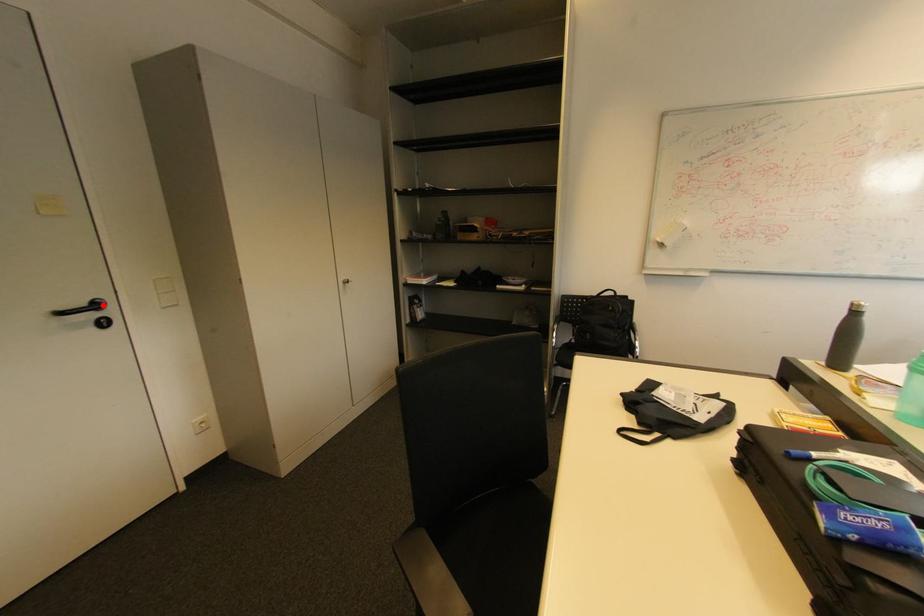
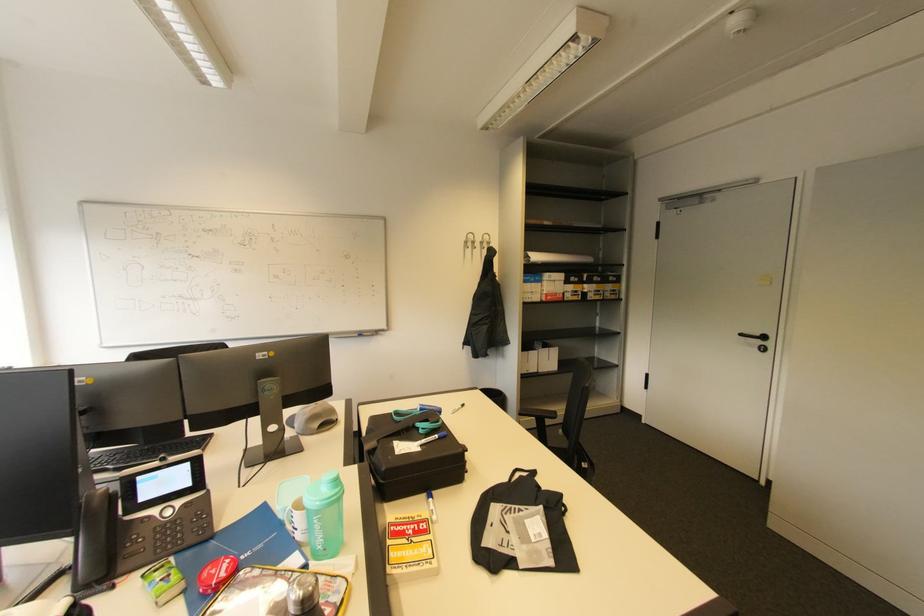
Locate, in the second image, the point that corresponds to the highlighted location in the first image.

(769, 339)